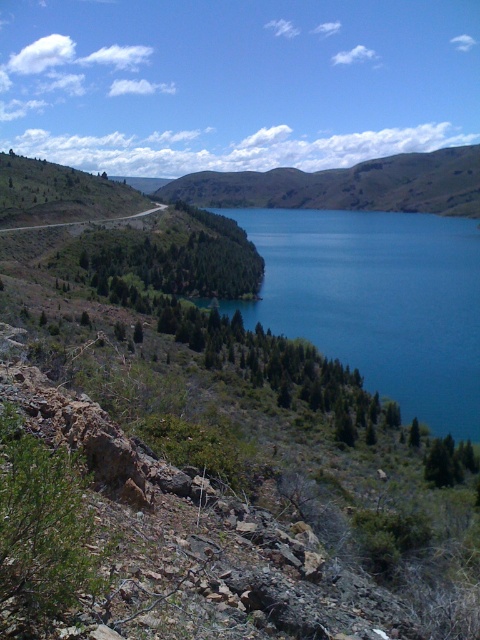
You are planning to take a photo of the landscape and want to ensure both the blue glossy water at center and the gray asphalt road at center are visible. Given their sizes, which one will occupy more of the frame?

The blue glossy water at center is larger in size than the gray asphalt road at center, so it will occupy more of the frame.

You are standing at the edge of the lake and want to determine which of the two points, point (460, 147) or point (85, 221), is closer to you. Based on the scene description, which point is nearer?

Point (460, 147) is further to the viewer than point (85, 221). Therefore, point (85, 221) is closer to you.

You are a hiker planning to cross the gray asphalt road at center to reach the green grassy hillside at center. Which path would allow you to cover more horizontal distance without crossing the road?

The green grassy hillside at center is wider than the gray asphalt road at center, so choosing the path along the green grassy hillside at center would allow you to cover more horizontal distance without crossing the road.